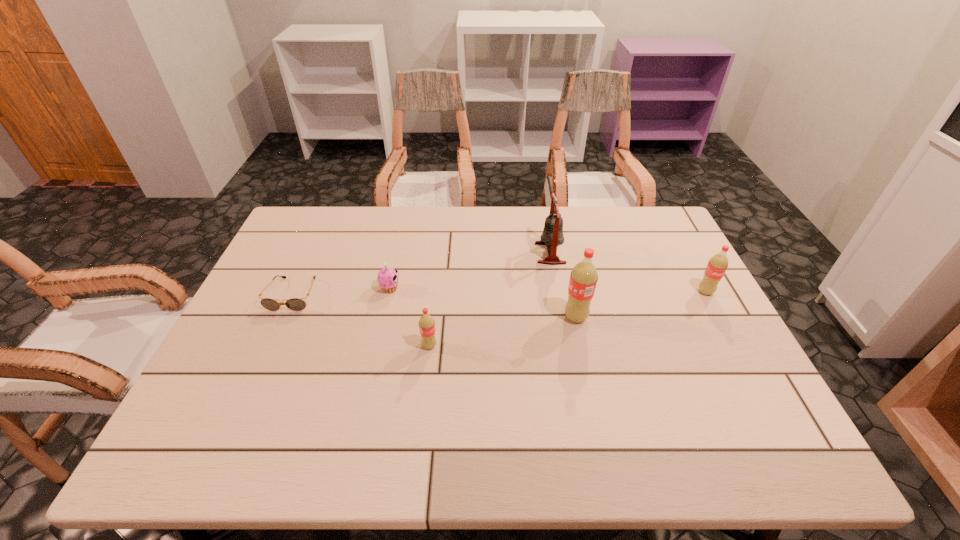
Given the evenly spaced sodas in the image, where should an extra soda be added on the left to preserve the spacing? Please point to a vacant space. Please provide its 2D coordinates. Your answer should be formatted as a tuple, i.e. [(x, y)], where the tuple contains the x and y coordinates of a point satisfying the conditions above.

[(262, 378)]